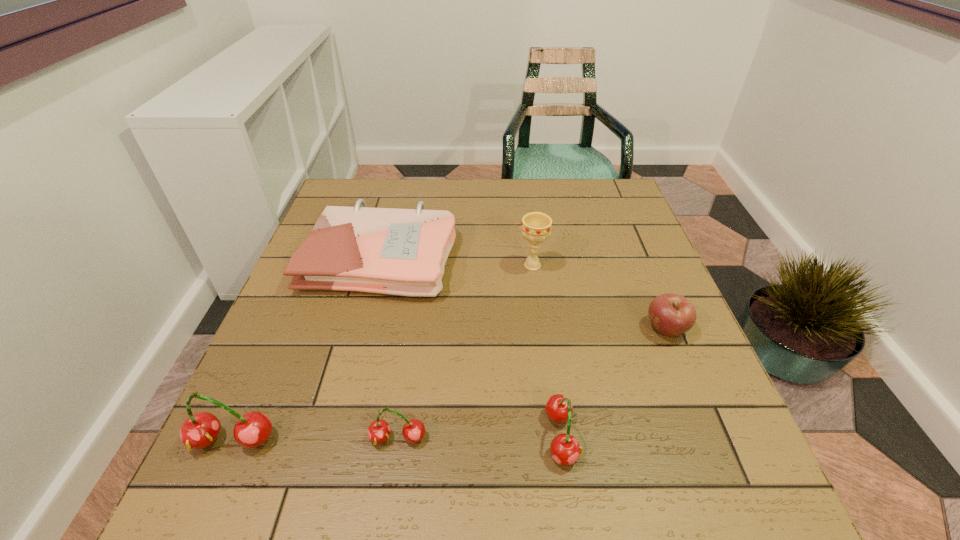
The image size is (960, 540). Identify the location of free point located on the side of the rightmost object with the unique marking. (589, 329).

I want to click on free region located on the side of the rightmost object with the unique marking, so (x=553, y=329).

You are a GUI agent. You are given a task and a screenshot of the screen. Output one action in this format:
    pyautogui.click(x=<x>, y=<y>)
    Task: Click on the vacant space located 0.220m on the side of the rightmost object with the unique marking
    The image size is (960, 540).
    Given the screenshot: What is the action you would take?
    pyautogui.click(x=544, y=329)

Identify the location of vacant space situated on the right of the phonebook. Image resolution: width=960 pixels, height=540 pixels. (598, 256).

Locate an element on the screen. object that is at the far edge is located at coordinates (403, 252).

Where is `cherry that is at the left edge`? cherry that is at the left edge is located at coordinates pyautogui.click(x=200, y=430).

What are the coordinates of `phonebook that is at the left edge` in the screenshot? It's located at (403, 252).

The width and height of the screenshot is (960, 540). What are the coordinates of `object situated at the right edge` in the screenshot? It's located at (671, 315).

Where is `object that is positioned at the far left corner`? The image size is (960, 540). object that is positioned at the far left corner is located at coordinates (403, 252).

Find the location of a particular element. The width and height of the screenshot is (960, 540). object located in the near left corner section of the desktop is located at coordinates (200, 430).